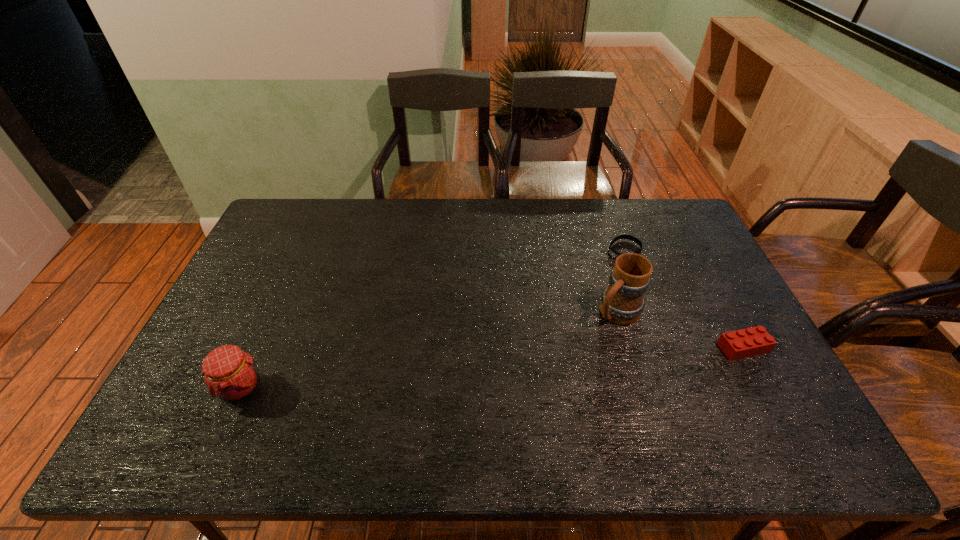
Where is `vacant space at the far edge`? This screenshot has width=960, height=540. vacant space at the far edge is located at coordinates (369, 201).

The height and width of the screenshot is (540, 960). In the image, there is a desktop. What are the coordinates of `vacant space at the near edge` in the screenshot? It's located at (337, 399).

Where is `vacant space at the right edge of the desktop`? vacant space at the right edge of the desktop is located at coordinates (703, 249).

Locate an element on the screen. The height and width of the screenshot is (540, 960). blank area at the far left corner is located at coordinates (301, 215).

I want to click on free space at the far right corner, so click(x=659, y=215).

Find the location of a particular element. The height and width of the screenshot is (540, 960). empty space between the third tallest object and the leftmost object is located at coordinates (492, 368).

You are a GUI agent. You are given a task and a screenshot of the screen. Output one action in this format:
    pyautogui.click(x=<x>, y=<y>)
    Task: Click on the empty location between the nearest object and the mug
    The width and height of the screenshot is (960, 540).
    Given the screenshot: What is the action you would take?
    pyautogui.click(x=429, y=350)

Find the location of a particular element. The height and width of the screenshot is (540, 960). unoccupied area between the jam and the farthest object is located at coordinates (433, 319).

Identify the location of free point between the rightmost object and the leftmost object. (492, 368).

This screenshot has height=540, width=960. In order to click on free spot between the jam and the mug in this screenshot , I will do `click(429, 350)`.